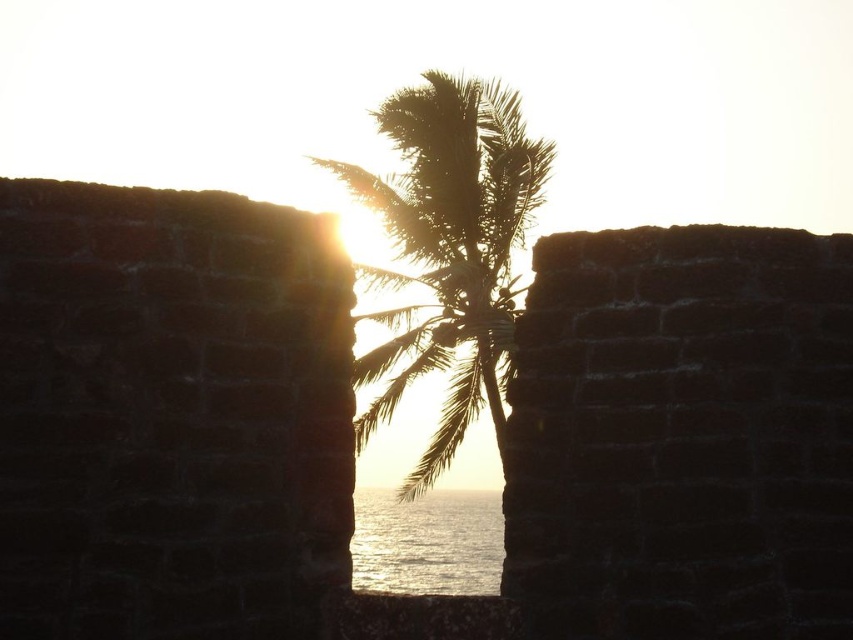
Does point (503, 445) come in front of point (372, 563)?

That is True.

This screenshot has height=640, width=853. Identify the location of silhouette leafy palm at center. (450, 250).

Who is more forward, (424, 124) or (483, 492)?

Positioned in front is point (424, 124).

You are a GUI agent. You are given a task and a screenshot of the screen. Output one action in this format:
    pyautogui.click(x=<x>, y=<y>)
    Task: Click on the silhouette leafy palm at center
    
    Given the screenshot: What is the action you would take?
    pyautogui.click(x=450, y=250)